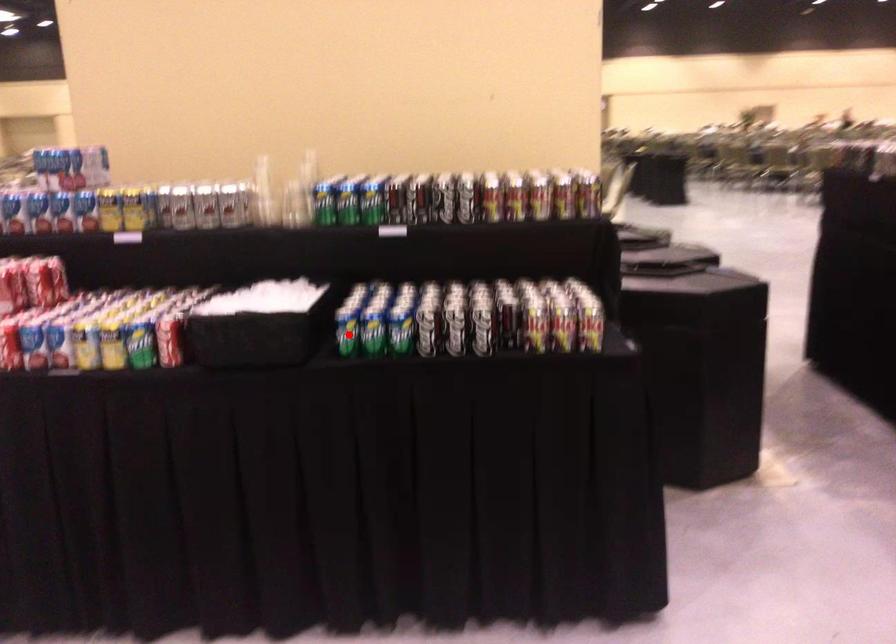
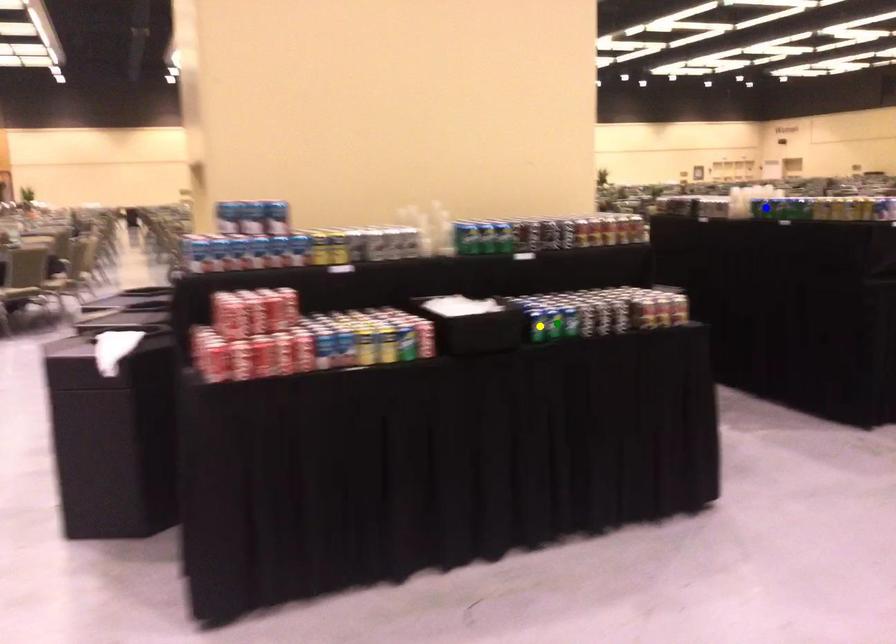
Question: I am providing you with two images of the same scene from different viewpoints. A red point is marked on the first image. You are given multiple points on the second image. Which point in image 2 is actually the same real-world point as the red point in image 1?

Choices:
 (A) green point
 (B) blue point
 (C) yellow point

Answer: (C)